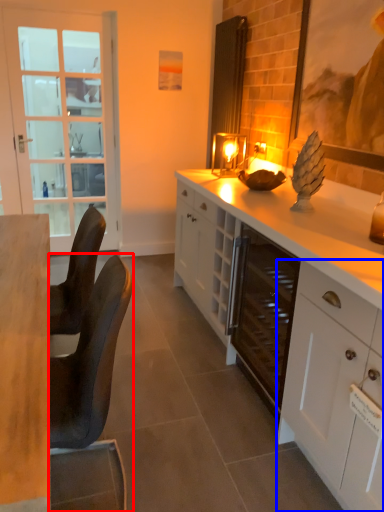
Question: Which of the following is the farthest to the observer, chair (highlighted by a red box) or cabinetry (highlighted by a blue box)?

Choices:
 (A) chair
 (B) cabinetry

Answer: (A)